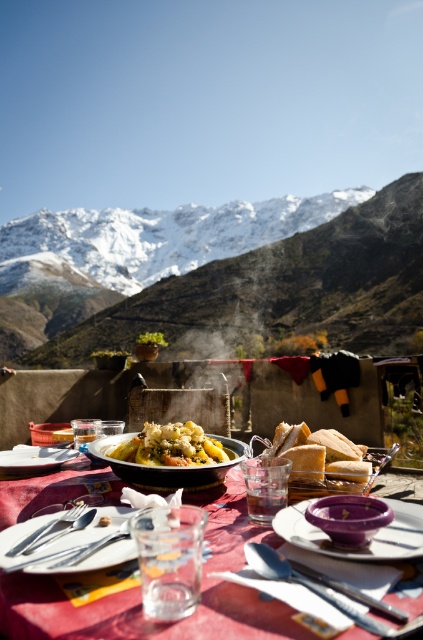
Question: Which object is positioned farthest from the shiny metal spoon at lower center?

Choices:
 (A) golden brown bread at center
 (B) purple matte bowl at center
 (C) snowy mountain at upper center
 (D) matte black platter at lower left

Answer: (C)

Question: Where is golden brown pasta at center located in relation to matte ceramic platter at center in the image?

Choices:
 (A) right
 (B) left

Answer: (A)

Question: Does translucent glass water at center come behind matte black platter at lower left?

Choices:
 (A) yes
 (B) no

Answer: (B)

Question: Which point is farther to the camera?

Choices:
 (A) purple matte bowl at center
 (B) golden brown bread at center
 (C) matte black platter at lower left

Answer: (C)

Question: Does matte ceramic platter at center lie behind matte black platter at lower left?

Choices:
 (A) no
 (B) yes

Answer: (A)

Question: Which of the following is the closest to the observer?

Choices:
 (A) (14, 596)
 (B) (27, 540)
 (C) (389, 548)

Answer: (A)